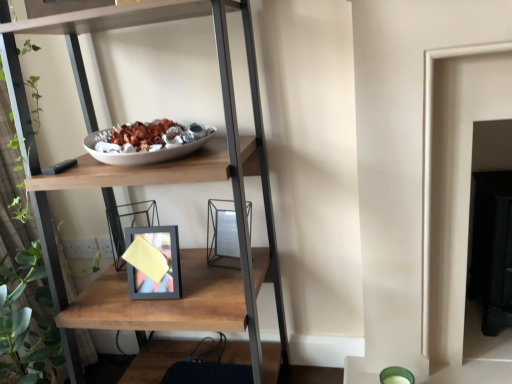
Question: In terms of size, does metallic silver picture frame at center appear bigger or smaller than wooden shelf at center?

Choices:
 (A) small
 (B) big

Answer: (A)

Question: Considering the relative positions of metallic silver picture frame at center and wooden shelf at center in the image provided, is metallic silver picture frame at center to the left or to the right of wooden shelf at center?

Choices:
 (A) left
 (B) right

Answer: (B)

Question: Is point (229, 225) closer or farther from the camera than point (257, 288)?

Choices:
 (A) farther
 (B) closer

Answer: (B)

Question: From a real-world perspective, is wooden shelf at center above or below metallic silver picture frame at center?

Choices:
 (A) below
 (B) above

Answer: (B)

Question: From their relative heights in the image, would you say wooden shelf at center is taller or shorter than metallic silver picture frame at center?

Choices:
 (A) short
 (B) tall

Answer: (B)

Question: Considering the positions of wooden shelf at center and metallic silver picture frame at center in the image, is wooden shelf at center wider or thinner than metallic silver picture frame at center?

Choices:
 (A) wide
 (B) thin

Answer: (A)

Question: From the image's perspective, is wooden shelf at center above or below metallic silver picture frame at center?

Choices:
 (A) above
 (B) below

Answer: (A)